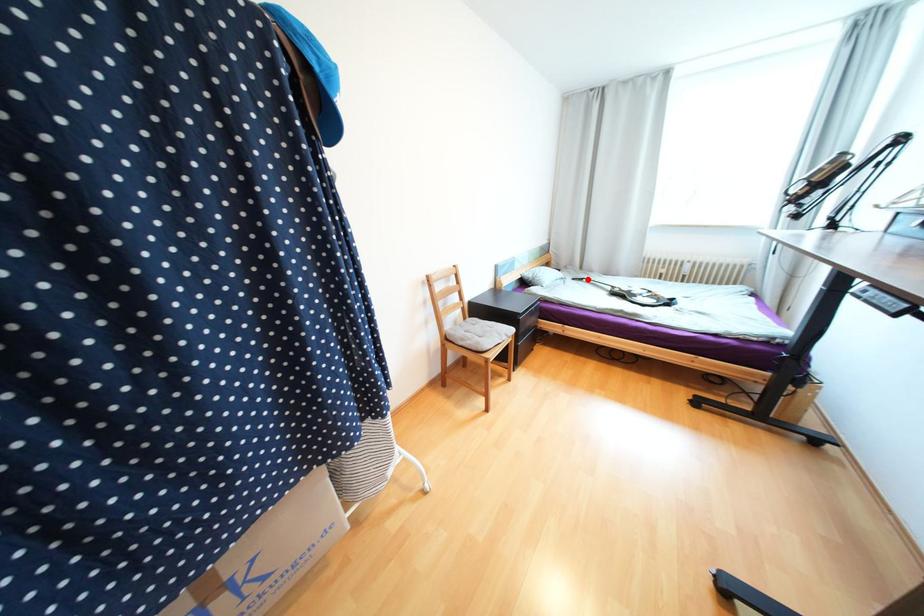
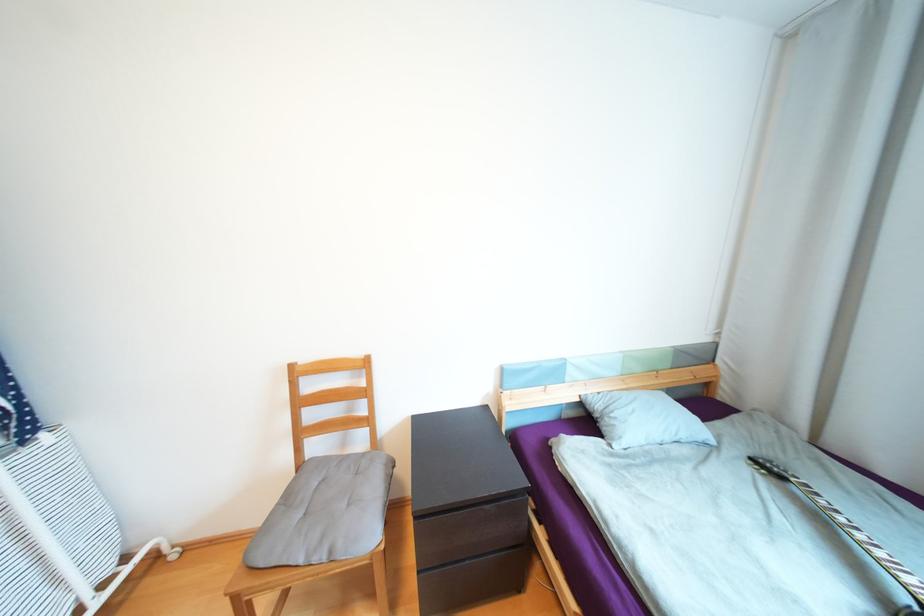
Locate, in the second image, the point that corresponds to the highlighted location in the first image.

(787, 477)